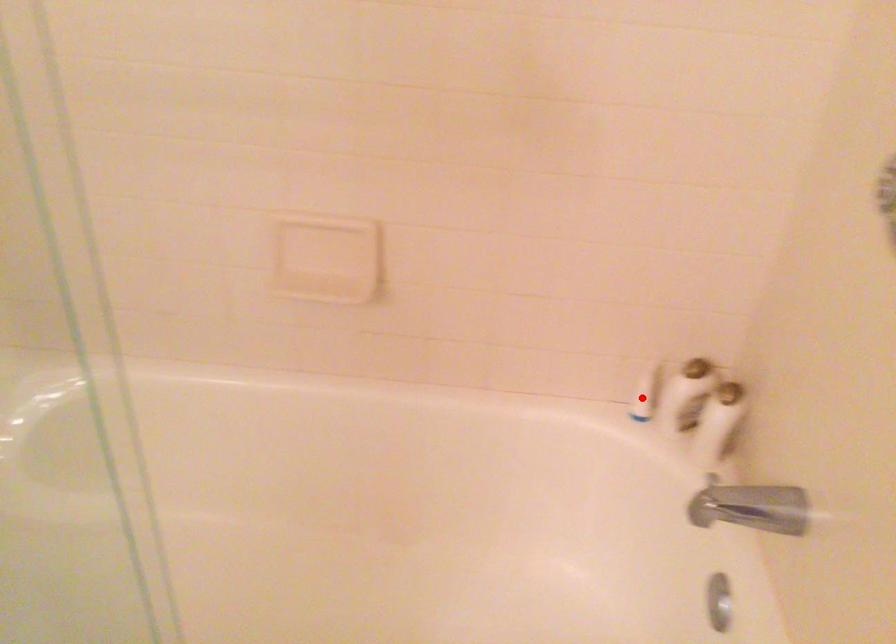
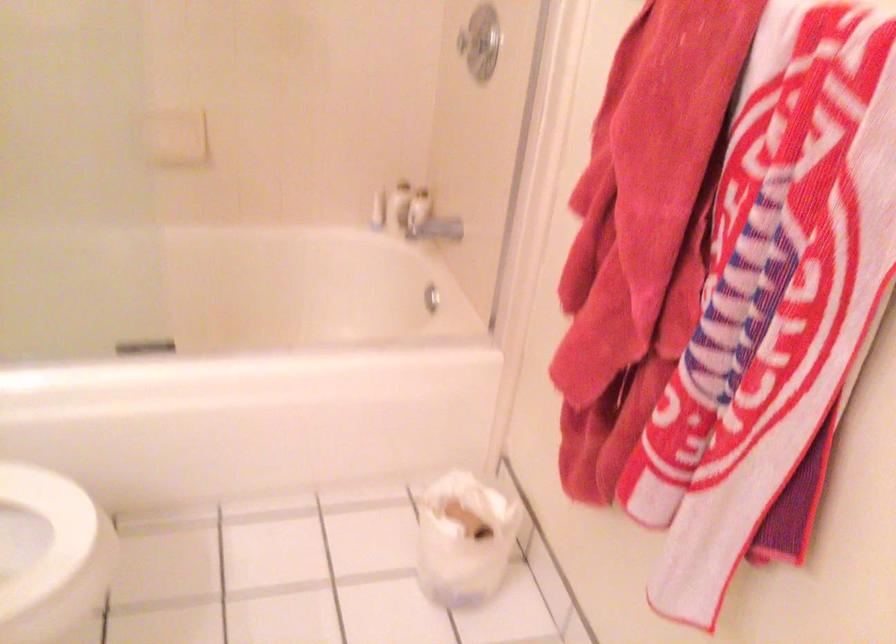
Question: I am providing you with two images of the same scene from different viewpoints. In image1, a red point is highlighted. Considering the same 3D point in image2, which of the following is correct?

Choices:
 (A) It is closer
 (B) It is farther

Answer: (B)